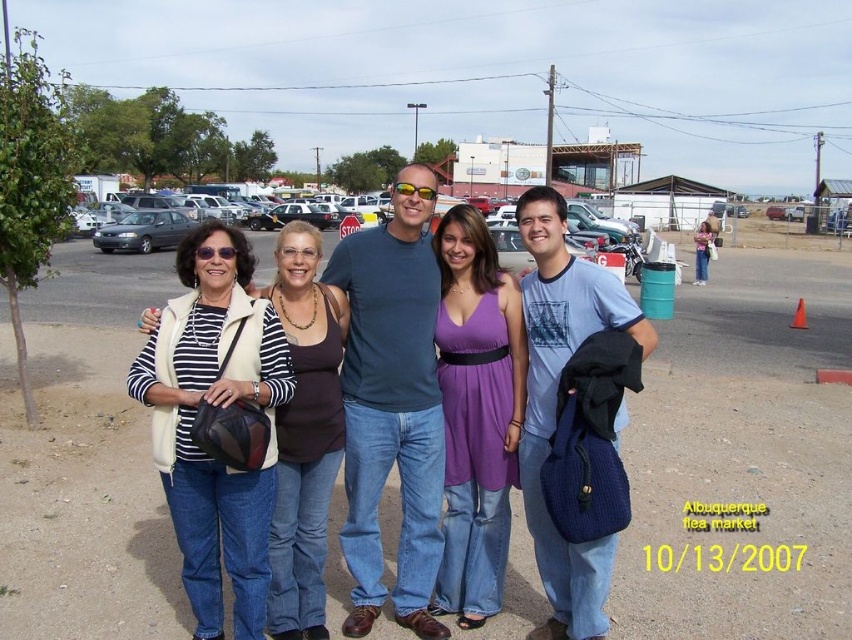
Question: Is matte black bag at center thinner than purple satin dress at center?

Choices:
 (A) yes
 (B) no

Answer: (B)

Question: Which point appears closest to the camera in this image?

Choices:
 (A) (327, 220)
 (B) (170, 243)

Answer: (B)

Question: Does purple satin dress at center appear over matte gray sedan at left?

Choices:
 (A) no
 (B) yes

Answer: (A)

Question: Can you confirm if matte black bag at center is bigger than matte gray sedan at left?

Choices:
 (A) no
 (B) yes

Answer: (A)

Question: Which of the following is the closest to the observer?

Choices:
 (A) 177,214
 (B) 323,220

Answer: (A)

Question: Based on their relative distances, which object is farther from the matte gray sedan at left?

Choices:
 (A) matte black bag at center
 (B) purple satin dress at center
 (C) matte black car at center

Answer: (B)